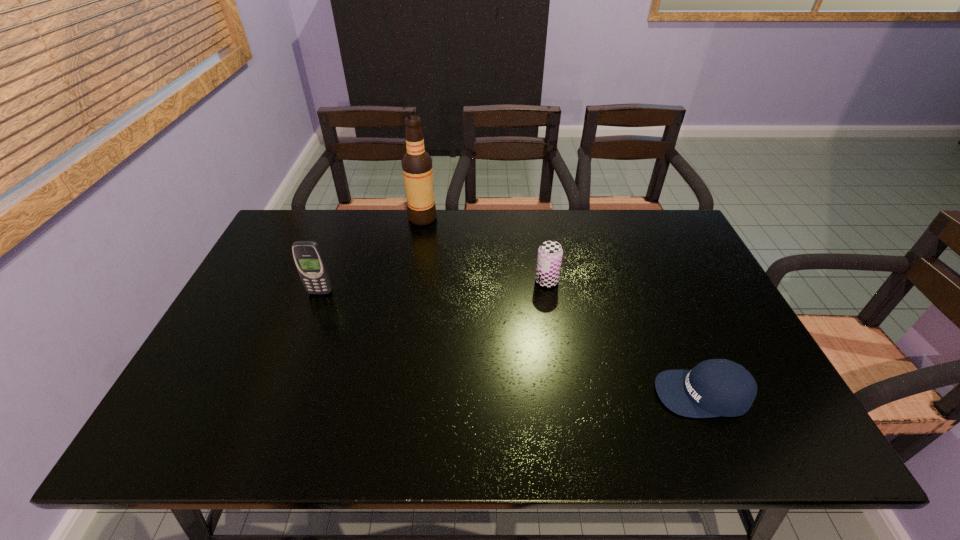
At what (x,y) coordinates should I click in order to perform the action: click on vacant space situated 0.060m on the front of the third tallest object. Please return your answer as a coordinate pair (x, y). This screenshot has width=960, height=540. Looking at the image, I should click on click(550, 305).

This screenshot has height=540, width=960. Find the location of `free location located on the front-facing side of the nearest object`. free location located on the front-facing side of the nearest object is located at coordinates (499, 394).

Locate an element on the screen. vacant region located on the front-facing side of the nearest object is located at coordinates (580, 394).

You are a GUI agent. You are given a task and a screenshot of the screen. Output one action in this format:
    pyautogui.click(x=<x>, y=<y>)
    Task: Click on the vacant region located on the front-facing side of the nearest object
    The width and height of the screenshot is (960, 540).
    Given the screenshot: What is the action you would take?
    pyautogui.click(x=615, y=394)

Locate an element on the screen. object located at the far edge is located at coordinates (417, 169).

The image size is (960, 540). Identify the location of object located at the near edge. (717, 387).

Where is `object present at the right edge`? object present at the right edge is located at coordinates (717, 387).

The width and height of the screenshot is (960, 540). I want to click on object that is at the near right corner, so pos(717,387).

The width and height of the screenshot is (960, 540). In the image, there is a desktop. Identify the location of vacant space at the far edge. (337, 215).

You are a GUI agent. You are given a task and a screenshot of the screen. Output one action in this format:
    pyautogui.click(x=<x>, y=<y>)
    Task: Click on the free space at the near edge of the desktop
    Image resolution: width=960 pixels, height=540 pixels.
    Given the screenshot: What is the action you would take?
    pyautogui.click(x=282, y=424)